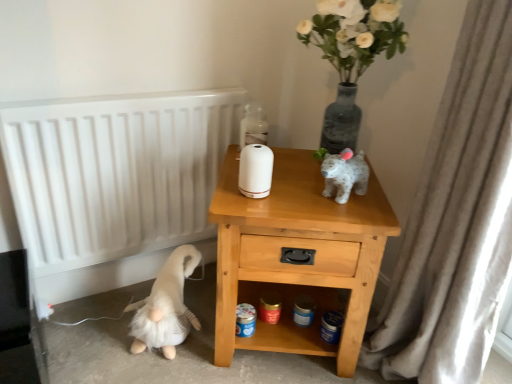
Question: Considering the relative sizes of white textured curtain at right and light wood/texture nightstand at center in the image provided, is white textured curtain at right wider than light wood/texture nightstand at center?

Choices:
 (A) yes
 (B) no

Answer: (B)

Question: Is the depth of white textured curtain at right less than that of light wood/texture nightstand at center?

Choices:
 (A) no
 (B) yes

Answer: (B)

Question: Is white textured curtain at right taller than light wood/texture nightstand at center?

Choices:
 (A) yes
 (B) no

Answer: (A)

Question: Can you confirm if white textured curtain at right is bigger than light wood/texture nightstand at center?

Choices:
 (A) no
 (B) yes

Answer: (A)

Question: Is white textured curtain at right at the left side of light wood/texture nightstand at center?

Choices:
 (A) no
 (B) yes

Answer: (A)

Question: From a real-world perspective, is white textured curtain at right over light wood/texture nightstand at center?

Choices:
 (A) no
 (B) yes

Answer: (B)

Question: Considering the relative positions of white textured curtain at right and white matte radiator at left in the image provided, is white textured curtain at right to the right of white matte radiator at left from the viewer's perspective?

Choices:
 (A) yes
 (B) no

Answer: (A)

Question: Are white textured curtain at right and white matte radiator at left located far from each other?

Choices:
 (A) no
 (B) yes

Answer: (A)

Question: Can you confirm if white textured curtain at right is taller than white matte radiator at left?

Choices:
 (A) no
 (B) yes

Answer: (B)

Question: From the image's perspective, is white textured curtain at right below white matte radiator at left?

Choices:
 (A) yes
 (B) no

Answer: (A)

Question: Considering the relative sizes of white textured curtain at right and white matte radiator at left in the image provided, is white textured curtain at right shorter than white matte radiator at left?

Choices:
 (A) no
 (B) yes

Answer: (A)

Question: Does white textured curtain at right come behind white matte radiator at left?

Choices:
 (A) no
 (B) yes

Answer: (A)

Question: Is translucent glass bottle at upper center closer to the viewer compared to light wood/texture nightstand at center?

Choices:
 (A) no
 (B) yes

Answer: (A)